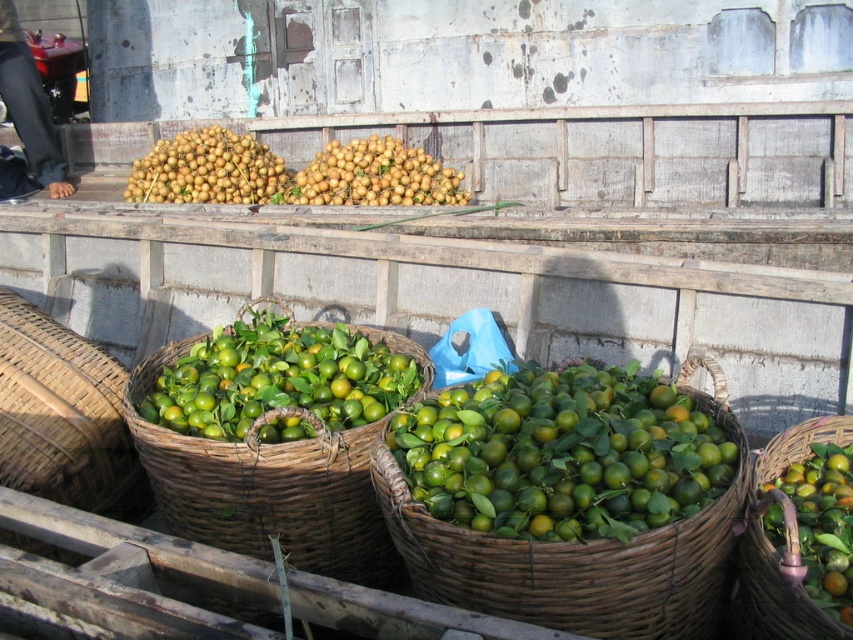
Who is positioned more to the right, green wicker basket at lower left or green woven basket at lower right?

From the viewer's perspective, green woven basket at lower right appears more on the right side.

Is point (259, 348) farther from viewer compared to point (788, 621)?

Yes, it is behind point (788, 621).

The image size is (853, 640). Find the location of `green wicker basket at lower left`. green wicker basket at lower left is located at coordinates (276, 436).

Can you confirm if green matte citrus fruits at center is positioned below green woven basket at lower right?

Incorrect, green matte citrus fruits at center is not positioned below green woven basket at lower right.

Does point (392, 352) come in front of point (753, 605)?

No, (392, 352) is behind (753, 605).

This screenshot has height=640, width=853. Describe the element at coordinates (277, 378) in the screenshot. I see `green matte citrus fruits at center` at that location.

Where is `green matte citrus fruits at center`? green matte citrus fruits at center is located at coordinates (277, 378).

Which is behind, point (740, 468) or point (178, 150)?

The point (178, 150) is more distant.

This screenshot has height=640, width=853. Identify the location of green wicker basket at center. (579, 556).